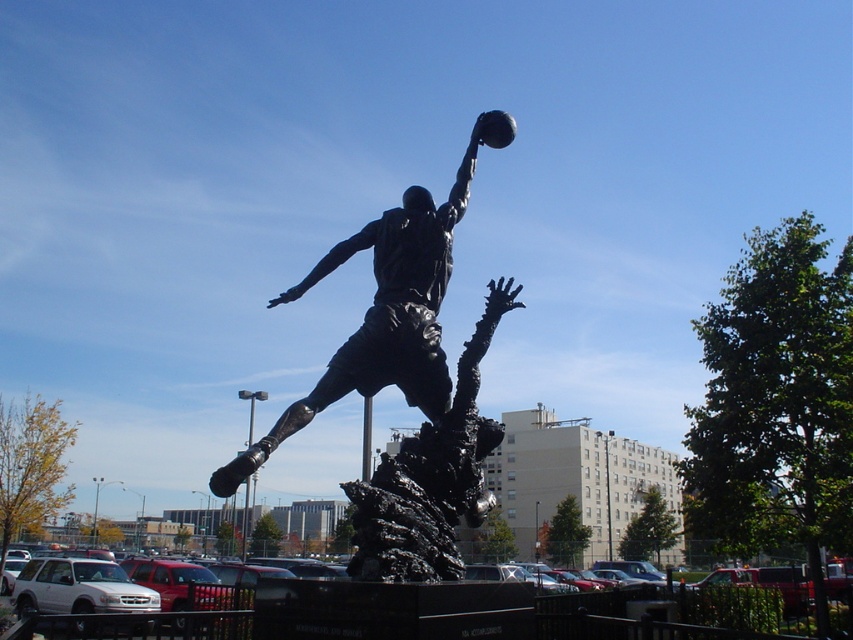
Does bronze statue at center have a greater width compared to black asphalt parking lot at center?

No.

Does bronze statue at center have a lesser width compared to black asphalt parking lot at center?

Correct, bronze statue at center's width is less than black asphalt parking lot at center's.

Between point (426, 268) and point (10, 636), which one is positioned in front?

Point (426, 268)

The image size is (853, 640). In order to click on bronze statue at center in this screenshot , I will do `click(389, 314)`.